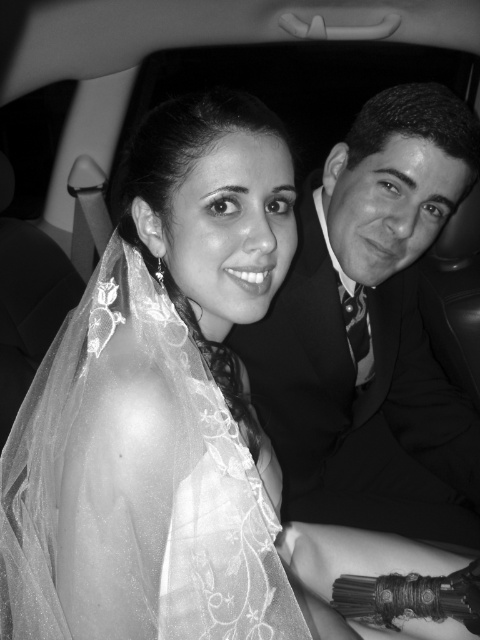
Who is more forward, (x=251, y=465) or (x=327, y=433)?

Point (x=251, y=465) is more forward.

Can you confirm if translucent lace veil at upper left is smaller than smooth black suit at right?

Yes, translucent lace veil at upper left is smaller than smooth black suit at right.

The image size is (480, 640). What do you see at coordinates (159, 406) in the screenshot?
I see `translucent lace veil at upper left` at bounding box center [159, 406].

Where is `translucent lace veil at upper left`? The height and width of the screenshot is (640, 480). translucent lace veil at upper left is located at coordinates (159, 406).